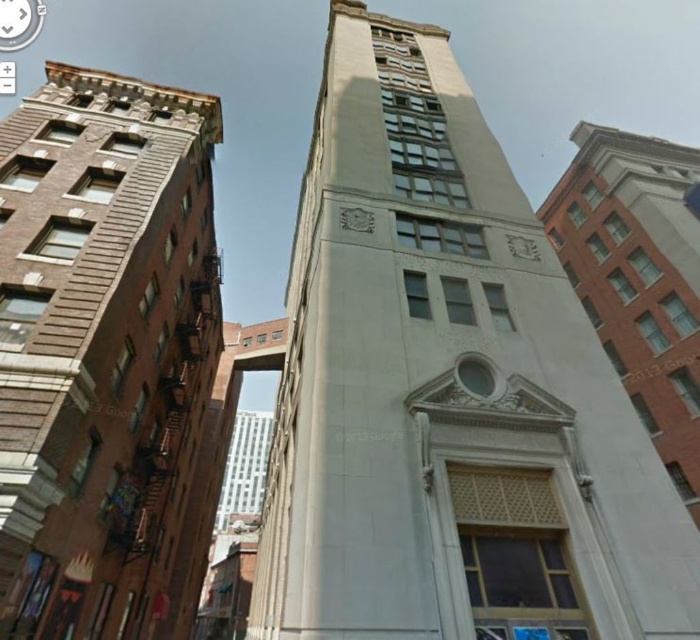
Question: Does brown brick building at left appear over white plastic clock at upper left?

Choices:
 (A) yes
 (B) no

Answer: (B)

Question: Can you confirm if brown brick building at left is bigger than white plastic clock at upper left?

Choices:
 (A) no
 (B) yes

Answer: (B)

Question: Among these objects, which one is nearest to the camera?

Choices:
 (A) white stone tower at center
 (B) white plastic clock at upper left
 (C) brown brick building at left

Answer: (A)

Question: Which object appears closest to the camera in this image?

Choices:
 (A) brown brick building at left
 (B) white stone tower at center
 (C) white plastic clock at upper left

Answer: (B)

Question: Does white stone tower at center appear on the left side of white plastic clock at upper left?

Choices:
 (A) yes
 (B) no

Answer: (B)

Question: Which point appears farthest from the camera in this image?

Choices:
 (A) (295, 589)
 (B) (15, 202)
 (C) (6, 38)

Answer: (C)